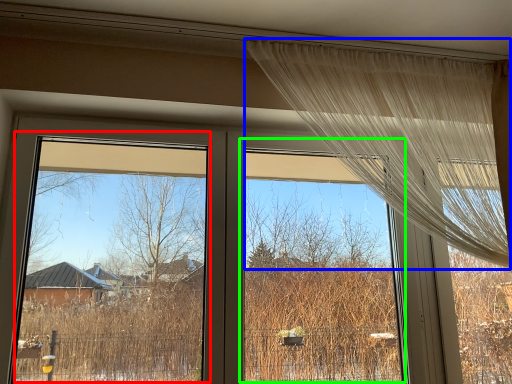
Question: Which object is the closest to the window screen (highlighted by a red box)? Choose among these: curtain (highlighted by a blue box) or window screen (highlighted by a green box).

Choices:
 (A) curtain
 (B) window screen

Answer: (B)